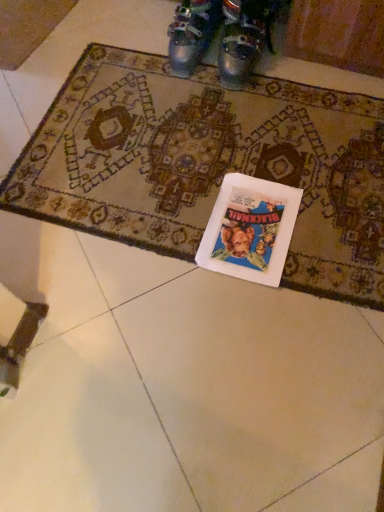
Where is `free point above carpeted mat at center (from a real-world perspective)`? The height and width of the screenshot is (512, 384). free point above carpeted mat at center (from a real-world perspective) is located at coordinates (210, 147).